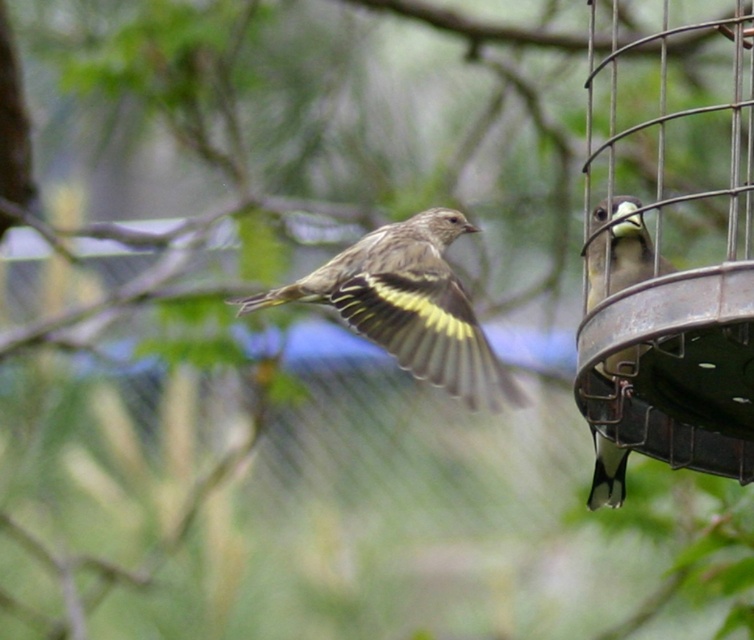
Question: Which object appears closest to the camera in this image?

Choices:
 (A) metallic wire bird feeder at right
 (B) brown speckled feathers at center

Answer: (B)

Question: Which of the following is the closest to the observer?

Choices:
 (A) (682, 120)
 (B) (589, 292)

Answer: (B)

Question: Is metallic wire bird feeder at right closer to the viewer compared to yellow-green feathers at right?

Choices:
 (A) yes
 (B) no

Answer: (B)

Question: Is metallic wire bird feeder at right to the left of yellow-green feathers at right from the viewer's perspective?

Choices:
 (A) yes
 (B) no

Answer: (B)

Question: Which of the following is the closest to the observer?

Choices:
 (A) yellow-green feathers at right
 (B) brown speckled feathers at center

Answer: (B)

Question: Does brown speckled feathers at center appear under yellow-green feathers at right?

Choices:
 (A) no
 (B) yes

Answer: (A)